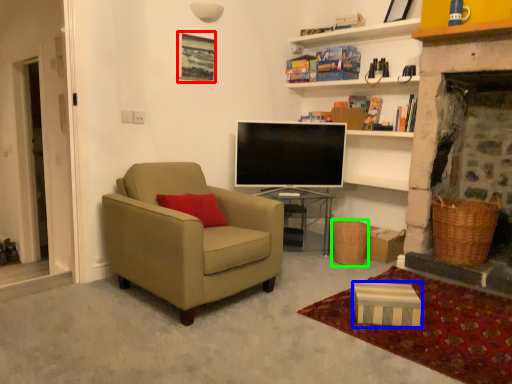
Question: Which is farther away from picture frame (highlighted by a red box)? box (highlighted by a blue box) or picnic basket (highlighted by a green box)?

Choices:
 (A) box
 (B) picnic basket

Answer: (A)